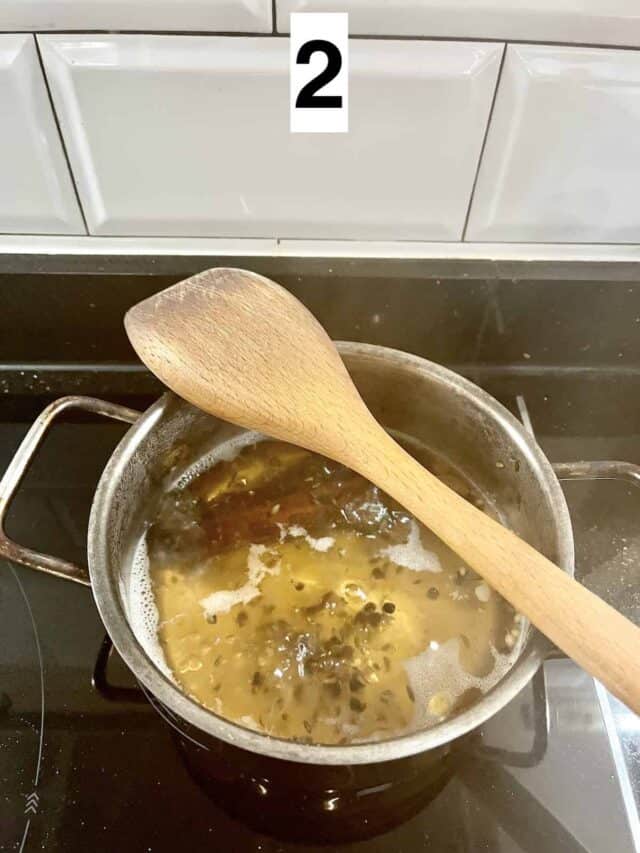
Identify the location of black glass stove top, electric. The width and height of the screenshot is (640, 853). (58, 327).